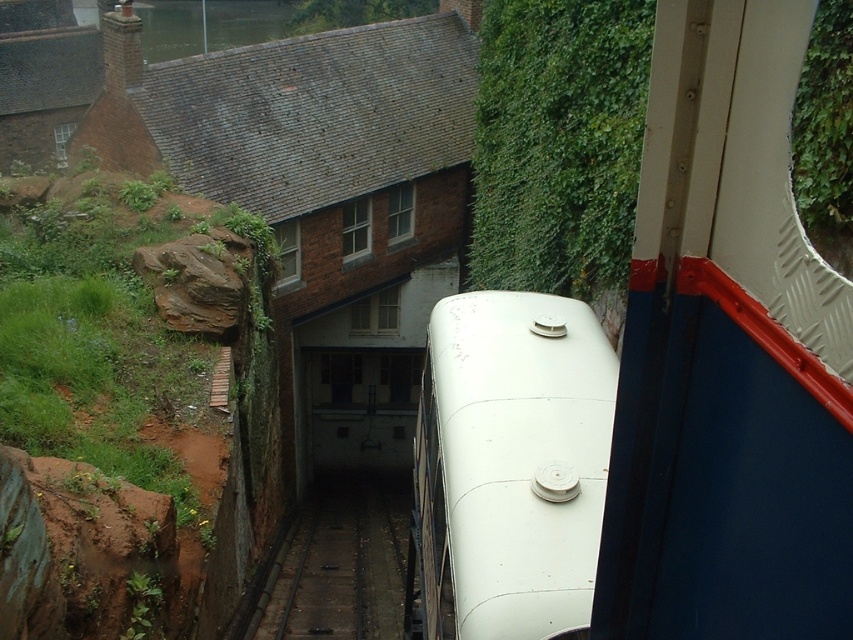
Which of these two, green leafy wall at upper center or dark gray metal train track at center, stands shorter?

dark gray metal train track at center is shorter.

Measure the distance between point (531,54) and camera.

They are 17.02 meters apart.

Does point (517, 268) come farther from viewer compared to point (283, 588)?

No, (517, 268) is in front of (283, 588).

Where is `green leafy wall at upper center`? The width and height of the screenshot is (853, 640). green leafy wall at upper center is located at coordinates (556, 141).

Which is above, white matte train at center or dark gray metal train track at center?

white matte train at center is above.

Between white matte train at center and dark gray metal train track at center, which one has more height?

dark gray metal train track at center is taller.

This screenshot has height=640, width=853. What do you see at coordinates (509, 467) in the screenshot?
I see `white matte train at center` at bounding box center [509, 467].

The width and height of the screenshot is (853, 640). I want to click on white matte train at center, so click(x=509, y=467).

Looking at this image, who is positioned more to the right, white matte train at center or green leafy wall at upper center?

Positioned to the right is green leafy wall at upper center.

Is point (572, 480) positioned before point (527, 225)?

Yes, point (572, 480) is in front of point (527, 225).

Is point (450, 493) behind point (608, 1)?

That is False.

This screenshot has height=640, width=853. Find the location of `white matte train at center`. white matte train at center is located at coordinates (509, 467).